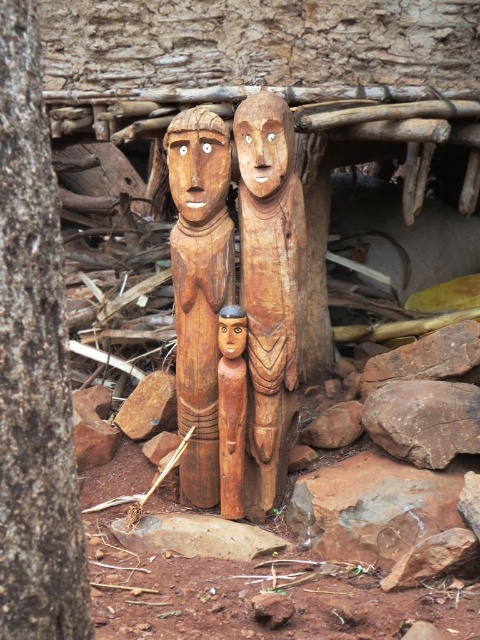
Does wooden statue at center appear under smooth wood figurine at center?

No, wooden statue at center is not below smooth wood figurine at center.

Between wooden statue at center and smooth wood figurine at center, which one has less height?

With less height is smooth wood figurine at center.

Is point (171, 234) positioned before point (239, 408)?

No, it is not.

Where is `wooden statue at center`? The image size is (480, 640). wooden statue at center is located at coordinates (200, 288).

Can you confirm if brown rough rock at center is smaller than brown rough stone at lower left?

No.

Which of these two, brown rough rock at center or brown rough stone at lower left, stands taller?

brown rough stone at lower left

Does point (403, 392) come farther from viewer compared to point (159, 372)?

That is False.

Where is `brown rough rock at center`? The height and width of the screenshot is (640, 480). brown rough rock at center is located at coordinates (423, 420).

Does point (29, 147) lie behind point (126, 401)?

No, it is not.

Who is positioned more to the right, brown rough tree trunk at left or brown rough stone at lower left?

brown rough tree trunk at left

The width and height of the screenshot is (480, 640). What are the coordinates of `brown rough tree trunk at left` in the screenshot? It's located at (34, 364).